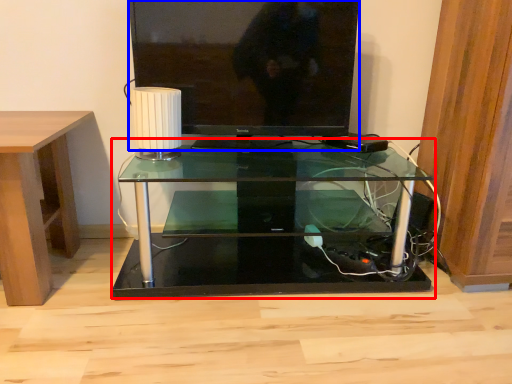
Question: Among these objects, which one is farthest to the camera, table (highlighted by a red box) or television (highlighted by a blue box)?

Choices:
 (A) table
 (B) television

Answer: (B)